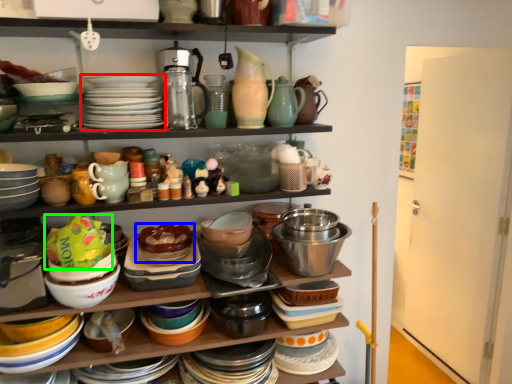
Question: Estimate the real-world distances between objects in this image. Which object is farther from platter (highlighted by a red box), bowl (highlighted by a blue box) or food (highlighted by a green box)?

Choices:
 (A) bowl
 (B) food

Answer: (A)